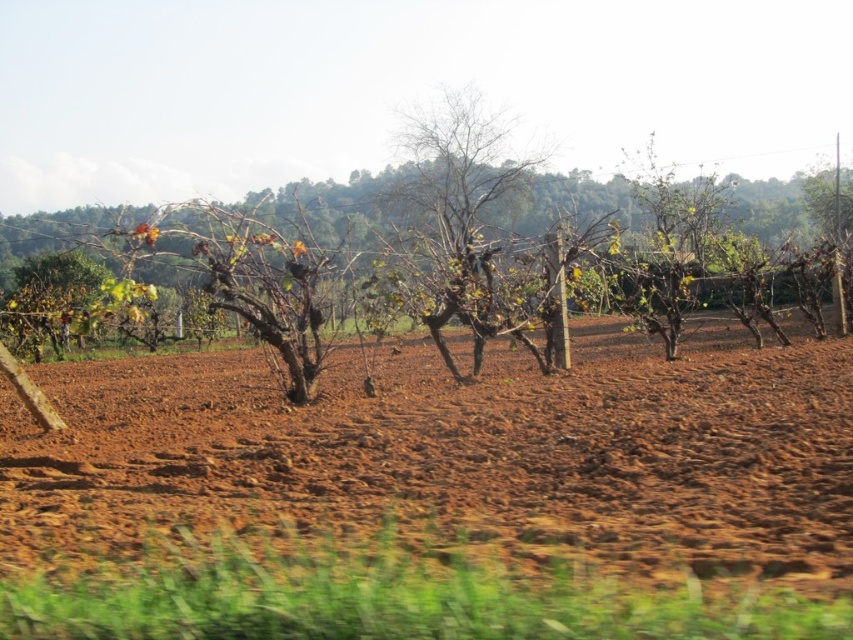
Does brown soil at center have a larger size compared to brown bark tree at center?

No, brown soil at center is not bigger than brown bark tree at center.

Who is more distant from viewer, (x=808, y=419) or (x=432, y=321)?

Positioned behind is point (x=432, y=321).

Between point (764, 504) and point (796, 291), which one is positioned in front?

Point (764, 504)

You are a GUI agent. You are given a task and a screenshot of the screen. Output one action in this format:
    pyautogui.click(x=<x>, y=<y>)
    Task: Click on the brown soil at center
    This screenshot has width=853, height=640.
    Given the screenshot: What is the action you would take?
    pyautogui.click(x=456, y=456)